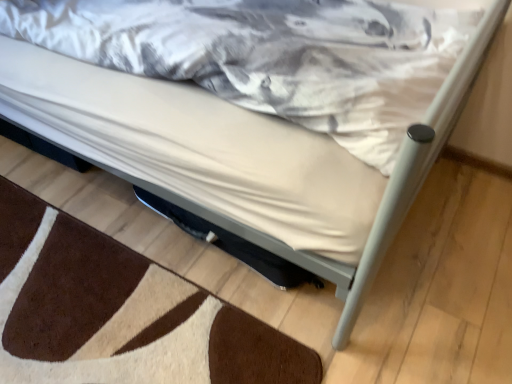
Identify the location of free point below brown shaggy rug at lower left (from a real-world perspective). (101, 311).